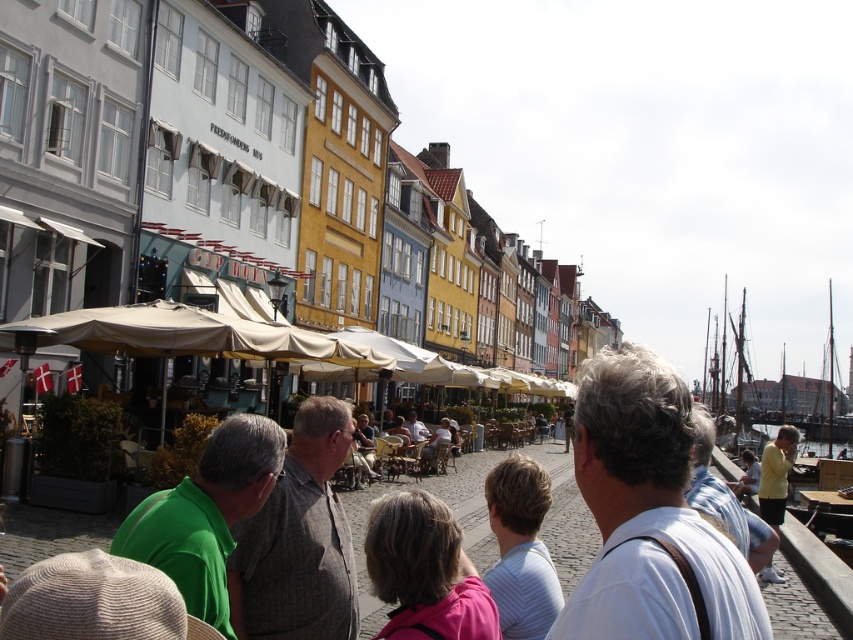
You are a photographer standing on the cobblestone path in the foreground of the street scene. You notice a green fabric shirt at center and a pink fabric at center in your view. Which fabric is positioned closer to you?

The green fabric shirt at center is closer to the viewer than the pink fabric at center, so the green fabric shirt at center is positioned closer to you.

You are a street vendor trying to decide where to place your cart. You notice a green fabric shirt at center and a pink fabric at center in the scene. Which fabric is wider, and would it be better to position your cart closer to the wider one to attract more attention?

The green fabric shirt at center is wider than the pink fabric at center. Positioning your cart closer to the green fabric shirt at center would be better to attract more attention due to its larger size.

You are a street vendor in the European city scene. You notice two shirts displayed in your shop window. The green fabric shirt at center and the yellow cotton shirt at lower right. A customer asks which shirt is smaller. How do you respond?

The green fabric shirt at center has a smaller size compared to the yellow cotton shirt at lower right, so the green fabric shirt at center is the smaller one.